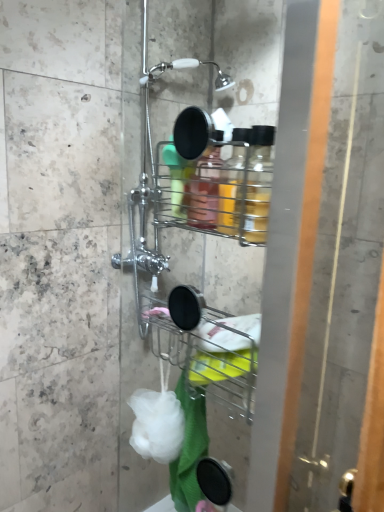
Question: Does transparent glass screen door at right appear on the left side of white matte sponge at lower center?

Choices:
 (A) yes
 (B) no

Answer: (B)

Question: Does transparent glass screen door at right have a lesser width compared to white matte sponge at lower center?

Choices:
 (A) no
 (B) yes

Answer: (B)

Question: Does transparent glass screen door at right touch white matte sponge at lower center?

Choices:
 (A) no
 (B) yes

Answer: (A)

Question: Is transparent glass screen door at right oriented away from white matte sponge at lower center?

Choices:
 (A) yes
 (B) no

Answer: (A)

Question: Could you tell me if transparent glass screen door at right is turned towards white matte sponge at lower center?

Choices:
 (A) no
 (B) yes

Answer: (B)

Question: Would you say transparent glass screen door at right is to the left or to the right of white matte sponge at lower center in the picture?

Choices:
 (A) right
 (B) left

Answer: (A)

Question: Is transparent glass screen door at right wider or thinner than white matte sponge at lower center?

Choices:
 (A) wide
 (B) thin

Answer: (B)

Question: From a real-world perspective, is transparent glass screen door at right positioned above or below white matte sponge at lower center?

Choices:
 (A) above
 (B) below

Answer: (A)

Question: Is transparent glass screen door at right spatially inside white matte sponge at lower center, or outside of it?

Choices:
 (A) inside
 (B) outside

Answer: (B)

Question: Looking at the image, does white matte sponge at lower center seem bigger or smaller compared to transparent glass screen door at right?

Choices:
 (A) small
 (B) big

Answer: (A)

Question: Visually, is white matte sponge at lower center positioned to the left or to the right of transparent glass screen door at right?

Choices:
 (A) left
 (B) right

Answer: (A)

Question: Considering the positions of white matte sponge at lower center and transparent glass screen door at right in the image, is white matte sponge at lower center taller or shorter than transparent glass screen door at right?

Choices:
 (A) tall
 (B) short

Answer: (B)

Question: From a real-world perspective, is white matte sponge at lower center positioned above or below transparent glass screen door at right?

Choices:
 (A) above
 (B) below

Answer: (B)

Question: Is white soft bath towel at lower center bigger or smaller than transparent glass screen door at right?

Choices:
 (A) big
 (B) small

Answer: (B)

Question: In the image, is white soft bath towel at lower center on the left side or the right side of transparent glass screen door at right?

Choices:
 (A) left
 (B) right

Answer: (A)